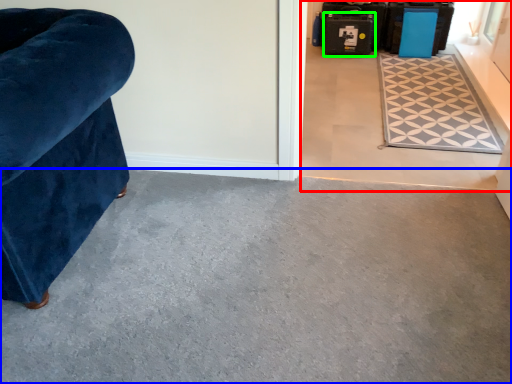
Question: Which object is the farthest from concrete (highlighted by a red box)? Choose among these: concrete (highlighted by a blue box) or luggage (highlighted by a green box).

Choices:
 (A) concrete
 (B) luggage

Answer: (A)